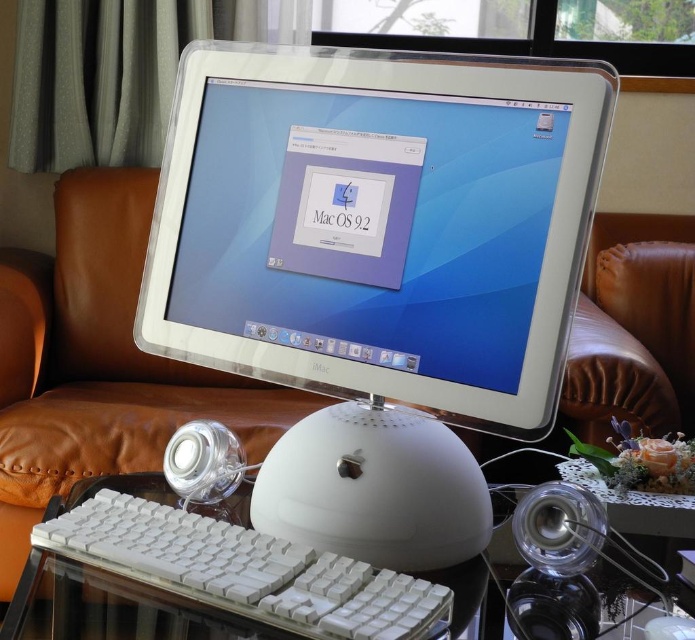
Question: Considering the relative positions of white plastic imac at center and white plastic mouse at center in the image provided, where is white plastic imac at center located with respect to white plastic mouse at center?

Choices:
 (A) below
 (B) above

Answer: (B)

Question: Which object is positioned closest to the white plastic imac at center?

Choices:
 (A) white plastic mouse at center
 (B) white plastic keyboard at center

Answer: (A)

Question: Does white plastic imac at center have a lesser width compared to white plastic mouse at center?

Choices:
 (A) yes
 (B) no

Answer: (B)

Question: Which point appears closest to the camera in this image?

Choices:
 (A) (234, 525)
 (B) (464, 296)
 (C) (343, 516)

Answer: (A)

Question: Can you confirm if white plastic mouse at center is positioned above white plastic keyboard at center?

Choices:
 (A) no
 (B) yes

Answer: (B)

Question: Considering the real-world distances, which object is closest to the white plastic imac at center?

Choices:
 (A) white plastic keyboard at center
 (B) white plastic mouse at center

Answer: (B)